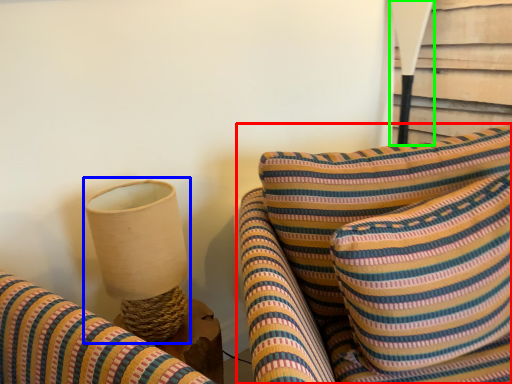
Question: Considering the real-world distances, which object is farthest from furniture (highlighted by a red box)? table lamp (highlighted by a blue box) or table lamp (highlighted by a green box)?

Choices:
 (A) table lamp
 (B) table lamp

Answer: (B)